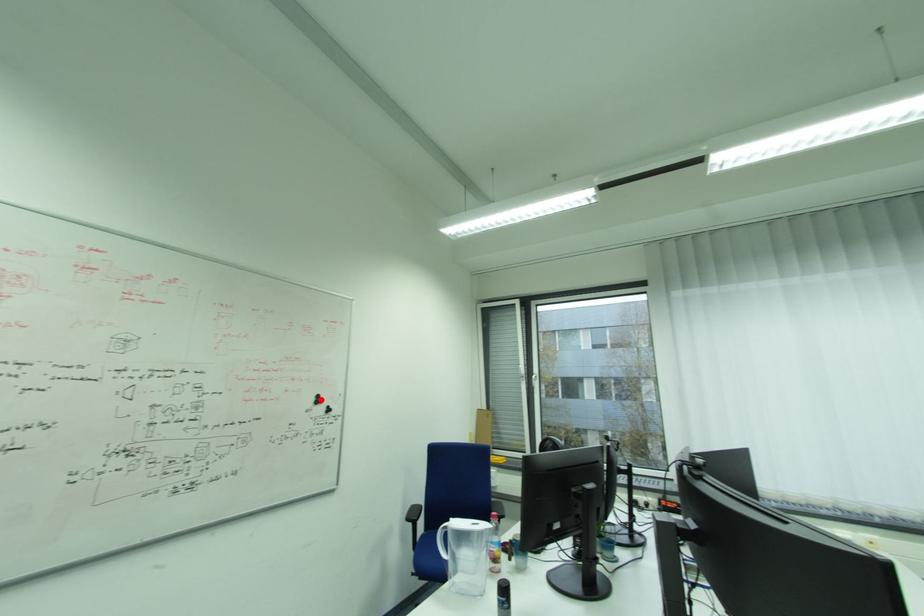
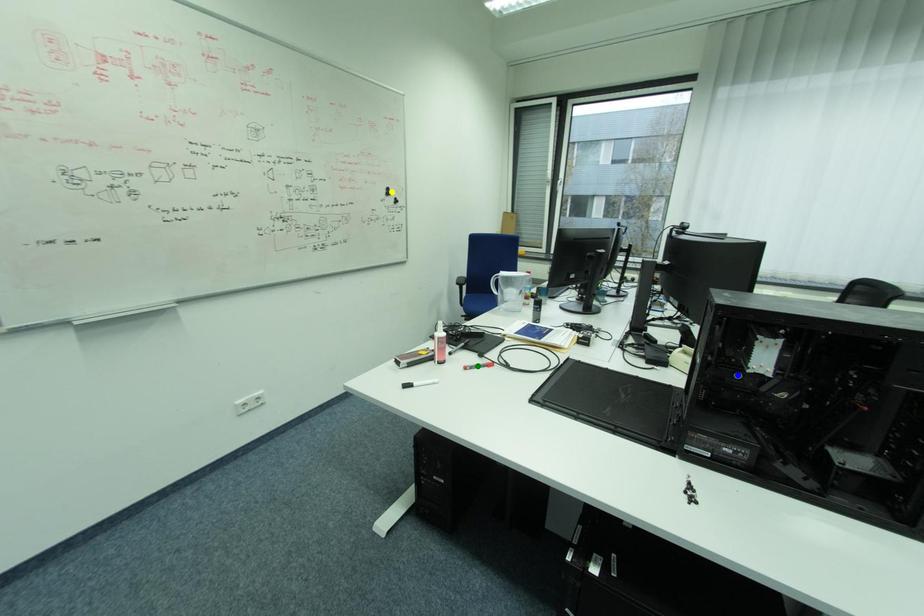
Question: I am providing you with two images of the same scene from different viewpoints. A red point is marked on the first image. You are given multiple points on the second image. In image 2, which mark is for the same physical point as the one in image 1?

Choices:
 (A) blue point
 (B) yellow point
 (C) green point

Answer: (B)